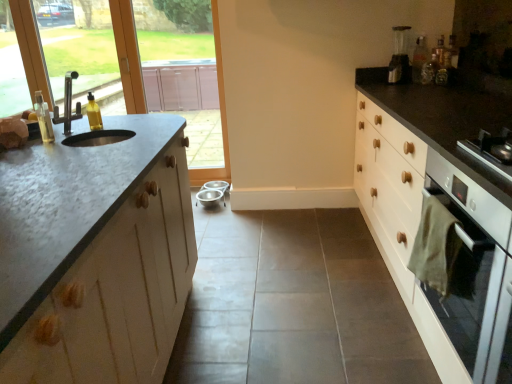
Question: Considering the relative sizes of white glossy oven at right and matte glass window screen at upper left, the 1th window screen from the right, in the image provided, is white glossy oven at right wider than matte glass window screen at upper left, the 1th window screen from the right,?

Choices:
 (A) yes
 (B) no

Answer: (A)

Question: Can you confirm if white glossy oven at right is smaller than matte glass window screen at upper left, which is counted as the 2th window screen, starting from the left?

Choices:
 (A) yes
 (B) no

Answer: (B)

Question: Could you tell me if white glossy oven at right is turned towards matte glass window screen at upper left, the 1th window screen from the right?

Choices:
 (A) no
 (B) yes

Answer: (A)

Question: Considering the relative sizes of white glossy oven at right and matte glass window screen at upper left, the 1th window screen from the right, in the image provided, is white glossy oven at right taller than matte glass window screen at upper left, the 1th window screen from the right,?

Choices:
 (A) no
 (B) yes

Answer: (A)

Question: From a real-world perspective, is white glossy oven at right on top of matte glass window screen at upper left, which is counted as the 2th window screen, starting from the left?

Choices:
 (A) no
 (B) yes

Answer: (A)

Question: From the image's perspective, is matte glass window screen at upper left, which is counted as the 2th window screen, starting from the left, located above or below translucent plastic soap dispenser at left, the 1th bottle when ordered from left to right?

Choices:
 (A) below
 (B) above

Answer: (B)

Question: Looking at the image, does matte glass window screen at upper left, which is counted as the 2th window screen, starting from the left, seem bigger or smaller compared to translucent plastic soap dispenser at left, positioned as the 1th bottle in front-to-back order?

Choices:
 (A) small
 (B) big

Answer: (B)

Question: Is matte glass window screen at upper left, the 1th window screen from the right, in front of or behind translucent plastic soap dispenser at left, the 3th bottle positioned from the back, in the image?

Choices:
 (A) front
 (B) behind

Answer: (B)

Question: Visually, is matte glass window screen at upper left, the 1th window screen from the right, positioned to the left or to the right of translucent plastic soap dispenser at left, which is the third bottle from right to left?

Choices:
 (A) right
 (B) left

Answer: (A)

Question: In terms of height, does translucent plastic bottle at upper right, which appears as the first bottle when viewed from the right, look taller or shorter compared to yellow translucent bottle at left, which is counted as the second bottle, starting from the left?

Choices:
 (A) short
 (B) tall

Answer: (B)

Question: In terms of width, does translucent plastic bottle at upper right, the 1th bottle from the back, look wider or thinner when compared to yellow translucent bottle at left, placed as the second bottle when sorted from right to left?

Choices:
 (A) wide
 (B) thin

Answer: (B)

Question: In the image, is translucent plastic bottle at upper right, which is the first bottle in top-to-bottom order, on the left side or the right side of yellow translucent bottle at left, the second bottle in the bottom-to-top sequence?

Choices:
 (A) right
 (B) left

Answer: (A)

Question: Considering their positions, is translucent plastic bottle at upper right, the 1th bottle from the back, located in front of or behind yellow translucent bottle at left, the second bottle in the bottom-to-top sequence?

Choices:
 (A) front
 (B) behind

Answer: (B)

Question: Relative to translucent plastic soap dispenser at left, the 1th bottle when ordered from left to right, is yellow translucent bottle at left, which is counted as the 2th bottle, starting from the top, in front or behind?

Choices:
 (A) behind
 (B) front

Answer: (A)

Question: Do you think yellow translucent bottle at left, arranged as the second bottle when viewed from the front, is within translucent plastic soap dispenser at left, which is the third bottle from right to left, or outside of it?

Choices:
 (A) outside
 (B) inside

Answer: (A)